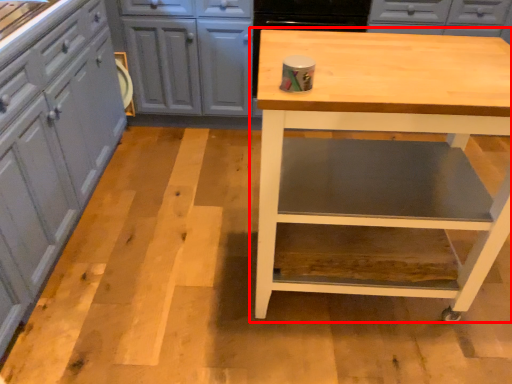
Question: From the image's perspective, considering the relative positions of table (annotated by the red box) and cabinetry in the image provided, where is table (annotated by the red box) located with respect to the staircase?

Choices:
 (A) below
 (B) above

Answer: (A)